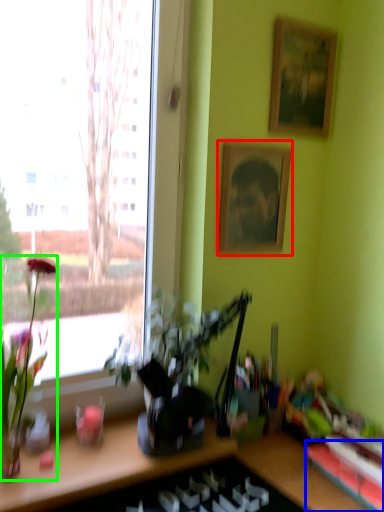
Question: Which object is positioned farthest from picture frame (highlighted by a red box)? Select from shelf (highlighted by a blue box) and houseplant (highlighted by a green box).

Choices:
 (A) shelf
 (B) houseplant

Answer: (A)